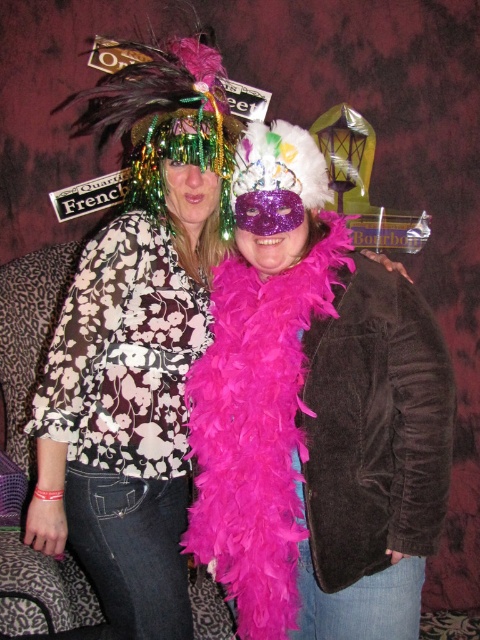
Does floral print blouse at left have a larger size compared to feathered headdress at upper center?

Indeed, floral print blouse at left has a larger size compared to feathered headdress at upper center.

Which is below, floral print blouse at left or feathered headdress at upper center?

floral print blouse at left is lower down.

Find the location of a particular element. The image size is (480, 640). floral print blouse at left is located at coordinates (127, 420).

Can you confirm if pink feather boa at center is positioned to the left of feathered headdress at upper center?

In fact, pink feather boa at center is to the right of feathered headdress at upper center.

Can you confirm if pink feather boa at center is bigger than feathered headdress at upper center?

Yes, pink feather boa at center is bigger than feathered headdress at upper center.

Is point (333, 289) farther from viewer compared to point (141, 100)?

No, it is in front of (141, 100).

Locate an element on the screen. Image resolution: width=480 pixels, height=640 pixels. pink feather boa at center is located at coordinates (315, 428).

Is point (450, 417) in front of point (175, 264)?

Yes, it is.

Who is positioned more to the right, pink feather boa at center or floral print blouse at left?

pink feather boa at center is more to the right.

Which is behind, point (252, 592) or point (160, 314)?

The point (160, 314) is behind.

I want to click on pink feather boa at center, so click(x=315, y=428).